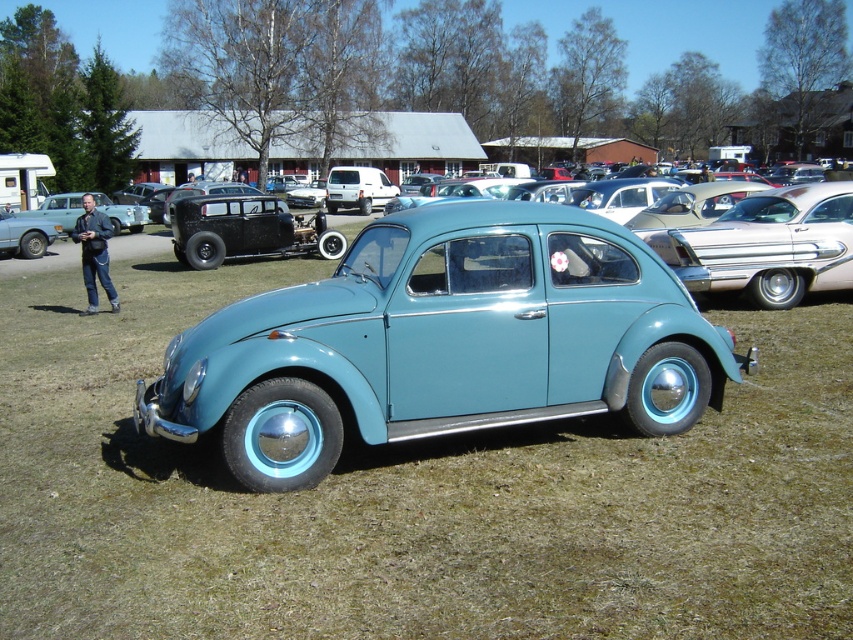
Question: Can you confirm if shiny silver sedan at right is bigger than matte black car at left?

Choices:
 (A) no
 (B) yes

Answer: (A)

Question: Which object is the closest to the matte black car at left?

Choices:
 (A) shiny silver sedan at right
 (B) light blue matte car at center

Answer: (A)

Question: Does light blue matte car at center appear on the right side of shiny silver sedan at right?

Choices:
 (A) no
 (B) yes

Answer: (A)

Question: Which object is the closest to the light blue matte car at center?

Choices:
 (A) shiny silver sedan at right
 (B) matte black car at left

Answer: (A)

Question: Which object appears closest to the camera in this image?

Choices:
 (A) matte black car at left
 (B) light blue matte car at center

Answer: (B)

Question: Is the position of light blue matte car at center less distant than that of matte black car at left?

Choices:
 (A) no
 (B) yes

Answer: (B)